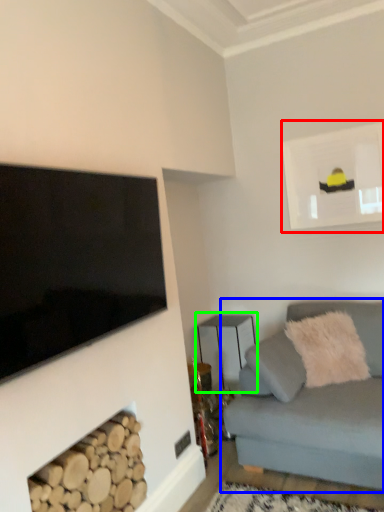
Question: Estimate the real-world distances between objects in this image. Which object is closer to picture frame (highlighted by a red box), studio couch (highlighted by a blue box) or table (highlighted by a green box)?

Choices:
 (A) studio couch
 (B) table

Answer: (B)